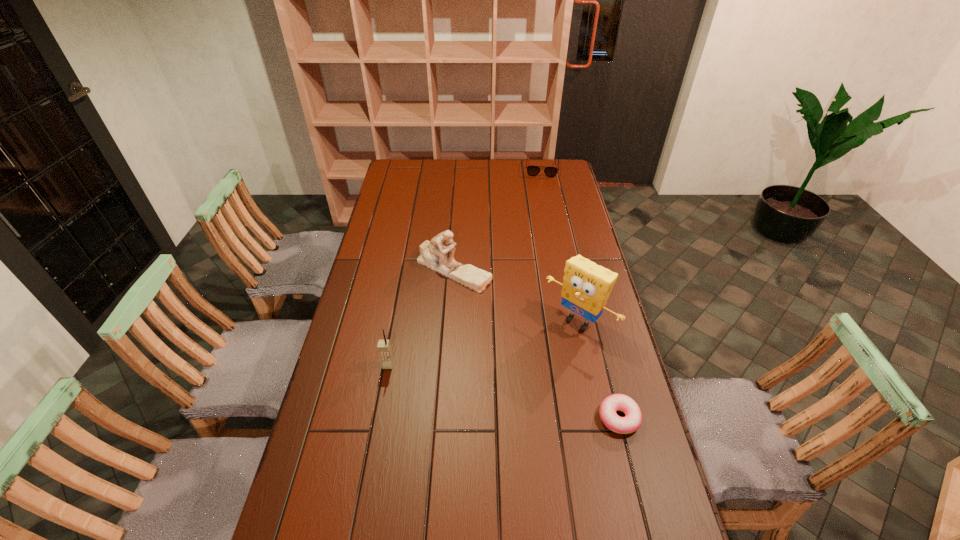
This screenshot has height=540, width=960. What are the coordinates of `vacant space located 0.230m on the front of the second nearest object, where the keypad is located` in the screenshot? It's located at (374, 440).

The height and width of the screenshot is (540, 960). I want to click on free space located on the back of the nearest object, so click(590, 305).

Find the location of a particular element. vacant space located on the front-facing side of the fourth nearest object is located at coordinates (476, 369).

You are a GUI agent. You are given a task and a screenshot of the screen. Output one action in this format:
    pyautogui.click(x=<x>, y=<y>)
    Task: Click on the vacant position located 0.110m on the front-facing side of the fourth nearest object
    
    Given the screenshot: What is the action you would take?
    pyautogui.click(x=464, y=315)

The height and width of the screenshot is (540, 960). What are the coordinates of `vacant position located 0.240m on the front-facing side of the fourth nearest object` in the screenshot? It's located at (470, 344).

This screenshot has width=960, height=540. In order to click on vacant space located on the front-facing side of the farthest object in this screenshot , I will do `click(541, 183)`.

At what (x,y) coordinates should I click in order to perform the action: click on vacant space located 0.160m on the front-facing side of the farthest object. Please return your answer as a coordinate pair (x, y). The width and height of the screenshot is (960, 540). Looking at the image, I should click on (540, 194).

I want to click on vacant space located on the front-facing side of the farthest object, so (x=540, y=202).

The image size is (960, 540). I want to click on free region located on the face of the tallest object, so click(x=492, y=410).

Image resolution: width=960 pixels, height=540 pixels. In order to click on free space located on the face of the tallest object in this screenshot , I will do pos(511,390).